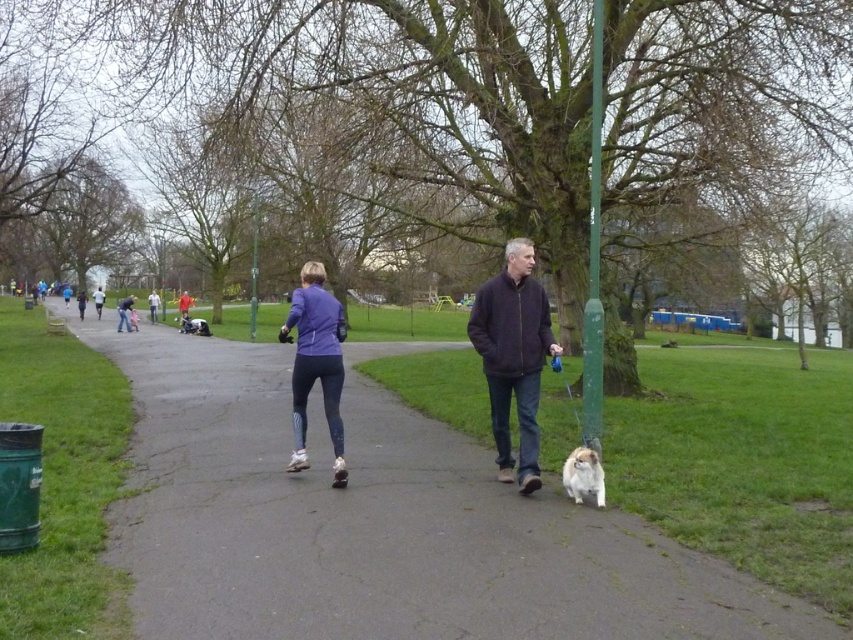
You are a photographer setting up a shot of the park scene. You want to ensure both the matte purple jacket at center and the green matte pole at right are in focus. Considering their sizes, which object should you adjust your camera focus on first to account for depth of field?

The matte purple jacket at center is larger than the green matte pole at right, so you should focus on the larger object first to ensure depth of field covers both.

You are a delivery person with a cart that is 15 feet long. You need to move your cart from the matte purple jacket at center to the green matte pole at right. Is there enough space between them to maneuver your cart without going around?

The distance between the matte purple jacket at center and the green matte pole at right is 14.30 feet. Since the cart is 15 feet long, there isn